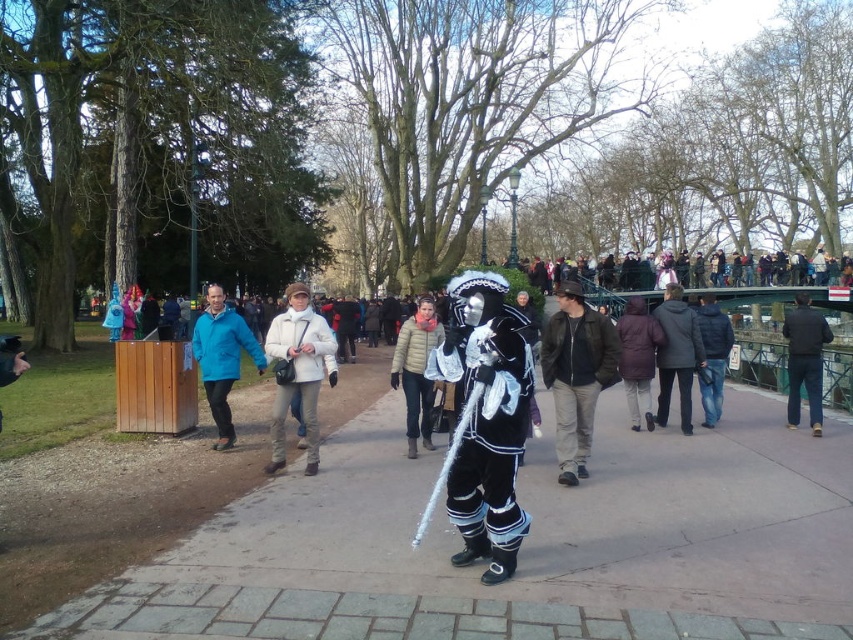
You are standing at the point marked as point (576, 374) in the image. What object is directly in front of you?

The point (576, 374) corresponds to the leather jacket at center, so the object directly in front of you is the leather jacket at center.

You are organizing a costume party and need to decide which jacket to wear. The white matte jacket at center is part of a theatrical outfit, and the dark blue puffy jacket at center is for warmth. Considering their sizes, which jacket would be more suitable if you want to appear more modest in size?

The white matte jacket at center has a smaller size compared to the dark blue puffy jacket at center, so it would be more suitable if you want to appear more modest in size.

You are standing at a viewpoint where you can see both the point at coordinates point (817, 371) and point (659, 346). If you want to take a photo that includes both points, which point should you focus on first to ensure both are in focus?

You should focus on point (659, 346) first because it is closer to you than point (817, 371), which is further away. By focusing on the closer point, the further point will also be within the depth of field.